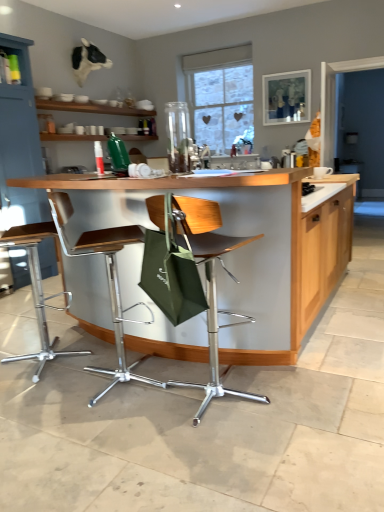
What do you see at coordinates (20, 136) in the screenshot?
I see `matte blue cabinet at upper left` at bounding box center [20, 136].

The image size is (384, 512). Describe the element at coordinates (178, 136) in the screenshot. I see `transparent glass vase at center` at that location.

At what (x,y) coordinates should I click in order to perform the action: click on brown leather chair at center, acting as the 3th chair starting from the left. Please return your answer as a coordinate pair (x, y). The width and height of the screenshot is (384, 512). Looking at the image, I should click on (205, 272).

The height and width of the screenshot is (512, 384). What do you see at coordinates (107, 280) in the screenshot? I see `metallic silver stool at center, positioned as the second chair in left-to-right order` at bounding box center [107, 280].

How much space does metallic silver bar stool at lower left, which appears as the first chair when viewed from the left, occupy vertically?

It is 3.52 feet.

At what (x,y) coordinates should I click in order to perform the action: click on metallic silver bar stool at lower left, which appears as the first chair when viewed from the left. Please return your answer as a coordinate pair (x, y). Image resolution: width=384 pixels, height=512 pixels. Looking at the image, I should click on (37, 288).

In order to click on matte blue cabinet at upper left in this screenshot , I will do `click(20, 136)`.

Which object is positioned more to the left, metallic silver stool at center, which is the second chair in right-to-left order, or wooden countertop at center?

Positioned to the left is metallic silver stool at center, which is the second chair in right-to-left order.

Where is `the 2nd chair below the wooden countertop at center (from a real-world perspective)`? Image resolution: width=384 pixels, height=512 pixels. the 2nd chair below the wooden countertop at center (from a real-world perspective) is located at coordinates (107, 280).

Is metallic silver stool at center, positioned as the second chair in left-to-right order, positioned far away from wooden countertop at center?

No, metallic silver stool at center, positioned as the second chair in left-to-right order, is not far from wooden countertop at center.

Which object is wider, metallic silver stool at center, which is the second chair in right-to-left order, or wooden countertop at center?

wooden countertop at center.

Is matte blue cabinet at upper left at the right side of metallic silver bar stool at lower left, arranged as the 3th chair when viewed from the right?

No, matte blue cabinet at upper left is not to the right of metallic silver bar stool at lower left, arranged as the 3th chair when viewed from the right.

Does matte blue cabinet at upper left turn towards metallic silver bar stool at lower left, which appears as the first chair when viewed from the left?

No, matte blue cabinet at upper left is not oriented towards metallic silver bar stool at lower left, which appears as the first chair when viewed from the left.

Is point (20, 155) closer to camera compared to point (46, 345)?

No, it is behind (46, 345).

Consider the image. Between matte blue cabinet at upper left and metallic silver bar stool at lower left, arranged as the 3th chair when viewed from the right, which one has more height?

With more height is matte blue cabinet at upper left.

From the image's perspective, which one is positioned lower, wooden countertop at center or metallic silver stool at center, which is the second chair in right-to-left order?

metallic silver stool at center, which is the second chair in right-to-left order.

Which point is more distant from viewer, (275, 256) or (83, 245)?

The point (83, 245) is farther from the camera.

Is metallic silver stool at center, which is the second chair in right-to-left order, at the back of wooden countertop at center?

Yes, wooden countertop at center is positioned with its back facing metallic silver stool at center, which is the second chair in right-to-left order.

In the image, is wooden countertop at center positioned in front of or behind metallic silver stool at center, which is the second chair in right-to-left order?

Visually, wooden countertop at center is located in front of metallic silver stool at center, which is the second chair in right-to-left order.

Considering the positions of objects matte blue cabinet at upper left and wooden countertop at center in the image provided, who is behind, matte blue cabinet at upper left or wooden countertop at center?

matte blue cabinet at upper left is more distant.

Identify the location of cabinetry behind the wooden countertop at center. The image size is (384, 512). (20, 136).

Is matte blue cabinet at upper left oriented away from wooden countertop at center?

No, matte blue cabinet at upper left's orientation is not away from wooden countertop at center.

Does matte blue cabinet at upper left have a larger size compared to wooden countertop at center?

Actually, matte blue cabinet at upper left might be smaller than wooden countertop at center.

From the image's perspective, who appears lower, metallic silver bar stool at lower left, arranged as the 3th chair when viewed from the right, or transparent glass vase at center?

From the image's view, metallic silver bar stool at lower left, arranged as the 3th chair when viewed from the right, is below.

Could transparent glass vase at center be considered to be inside metallic silver bar stool at lower left, arranged as the 3th chair when viewed from the right?

That's incorrect, transparent glass vase at center is not inside metallic silver bar stool at lower left, arranged as the 3th chair when viewed from the right.

From a real-world perspective, is wooden countertop at center positioned under transparent glass vase at center based on gravity?

Yes, from a real-world perspective, wooden countertop at center is below transparent glass vase at center.

Is there a large distance between wooden countertop at center and transparent glass vase at center?

wooden countertop at center is far away from transparent glass vase at center.

Who is taller, wooden countertop at center or transparent glass vase at center?

wooden countertop at center.

Is point (225, 362) more distant than point (169, 142)?

No.

From the image's perspective, is metallic silver stool at center, positioned as the second chair in left-to-right order, located above metallic silver bar stool at lower left, arranged as the 3th chair when viewed from the right?

Actually, metallic silver stool at center, positioned as the second chair in left-to-right order, appears below metallic silver bar stool at lower left, arranged as the 3th chair when viewed from the right, in the image.

Is metallic silver stool at center, positioned as the second chair in left-to-right order, at the left side of metallic silver bar stool at lower left, which appears as the first chair when viewed from the left?

No.

Measure the distance from metallic silver stool at center, which is the second chair in right-to-left order, to metallic silver bar stool at lower left, arranged as the 3th chair when viewed from the right.

metallic silver stool at center, which is the second chair in right-to-left order, and metallic silver bar stool at lower left, arranged as the 3th chair when viewed from the right, are 14.07 inches apart.

From a real-world perspective, is metallic silver stool at center, positioned as the second chair in left-to-right order, below metallic silver bar stool at lower left, arranged as the 3th chair when viewed from the right?

No, from a real-world perspective, metallic silver stool at center, positioned as the second chair in left-to-right order, is not below metallic silver bar stool at lower left, arranged as the 3th chair when viewed from the right.

Find the location of a particular element. Image resolution: width=384 pixels, height=512 pixels. countertop in front of the metallic silver stool at center, positioned as the second chair in left-to-right order is located at coordinates (243, 247).

I want to click on chair that is the 1st one when counting downward from the matte blue cabinet at upper left (from the image's perspective), so click(37, 288).

Consider the image. Which object lies nearer to the anchor point metallic silver stool at center, positioned as the second chair in left-to-right order, wooden countertop at center or transparent glass vase at center?

wooden countertop at center.

Looking at the image, which one is located closer to metallic silver stool at center, which is the second chair in right-to-left order, matte blue cabinet at upper left or transparent glass vase at center?

The object closer to metallic silver stool at center, which is the second chair in right-to-left order, is matte blue cabinet at upper left.

When comparing their distances from metallic silver bar stool at lower left, which appears as the first chair when viewed from the left, does transparent glass vase at center or matte blue cabinet at upper left seem further?

Among the two, transparent glass vase at center is located further to metallic silver bar stool at lower left, which appears as the first chair when viewed from the left.

Based on their spatial positions, is metallic silver stool at center, positioned as the second chair in left-to-right order, or transparent glass vase at center further from matte blue cabinet at upper left?

Based on the image, transparent glass vase at center appears to be further to matte blue cabinet at upper left.

When comparing their distances from brown leather chair at center, acting as the 3th chair starting from the left, does metallic silver stool at center, which is the second chair in right-to-left order, or wooden countertop at center seem closer?

The object closer to brown leather chair at center, acting as the 3th chair starting from the left, is wooden countertop at center.

Looking at the image, which one is located closer to brown leather chair at center, which is counted as the 1th chair, starting from the right, transparent glass vase at center or metallic silver stool at center, positioned as the second chair in left-to-right order?

metallic silver stool at center, positioned as the second chair in left-to-right order, lies closer to brown leather chair at center, which is counted as the 1th chair, starting from the right, than the other object.

Looking at the image, which one is located further to transparent glass vase at center, wooden countertop at center or metallic silver bar stool at lower left, which appears as the first chair when viewed from the left?

Answer: Based on the image, wooden countertop at center appears to be further to transparent glass vase at center.

From the image, which object appears to be nearer to wooden countertop at center, metallic silver stool at center, positioned as the second chair in left-to-right order, or transparent glass vase at center?

Among the two, metallic silver stool at center, positioned as the second chair in left-to-right order, is located nearer to wooden countertop at center.

I want to click on appliance between matte blue cabinet at upper left and brown leather chair at center, which is counted as the 1th chair, starting from the right, so click(178, 136).

The width and height of the screenshot is (384, 512). What are the coordinates of `appliance between matte blue cabinet at upper left and wooden countertop at center in the horizontal direction` in the screenshot? It's located at (178, 136).

The width and height of the screenshot is (384, 512). What are the coordinates of `chair between metallic silver stool at center, positioned as the second chair in left-to-right order, and matte blue cabinet at upper left in the front-back direction` in the screenshot? It's located at (37, 288).

Locate an element on the screen. The image size is (384, 512). chair located between metallic silver stool at center, positioned as the second chair in left-to-right order, and wooden countertop at center in the left-right direction is located at coordinates (205, 272).